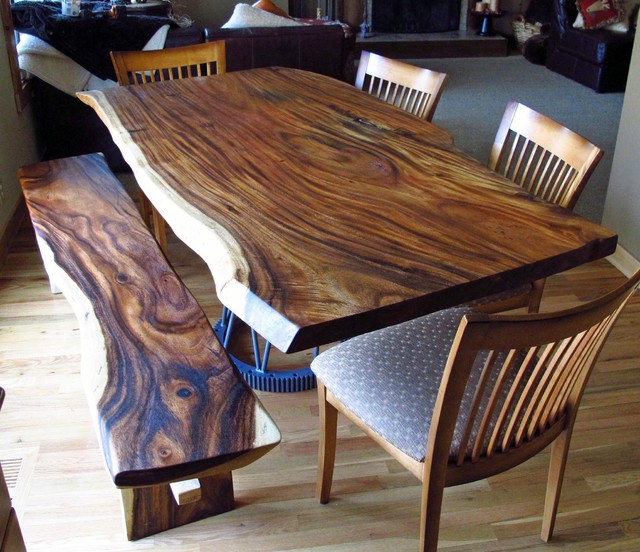
This screenshot has height=552, width=640. I want to click on carpeted floor, so click(x=495, y=95).